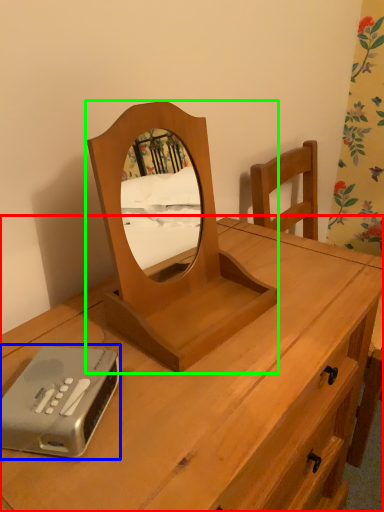
Question: Considering the real-world distances, which object is closest to desk (highlighted by a red box)? gadget (highlighted by a blue box) or mirror (highlighted by a green box).

Choices:
 (A) gadget
 (B) mirror

Answer: (B)